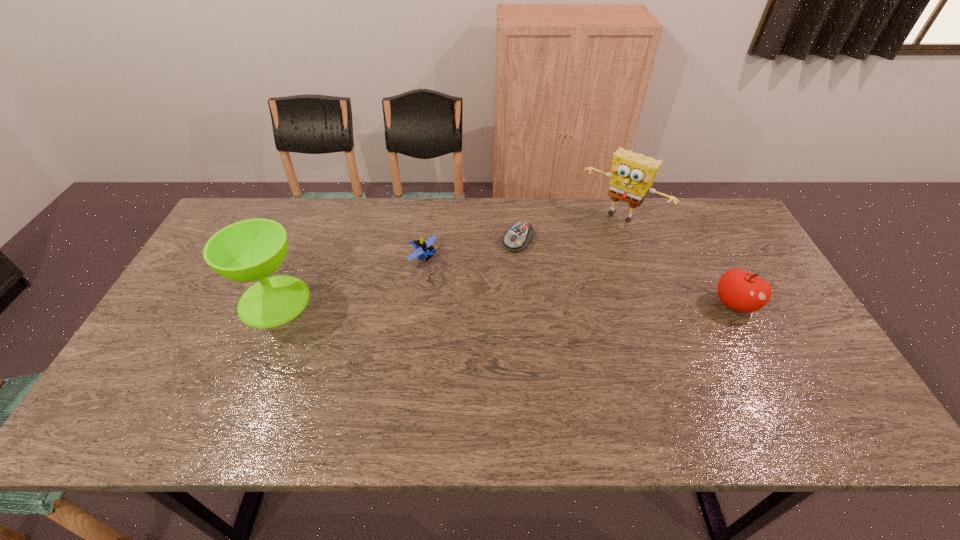
Identify the location of vacant space on the desktop that is between the leftmost object and the third shortest object and is positioned on the front-facing side of the Lego. Image resolution: width=960 pixels, height=540 pixels. (515, 303).

Find the location of a particular element. free spot on the desktop that is between the leftmost object and the rightmost object and is positioned on the face of the second object from right to left is located at coordinates (550, 303).

Where is `free space on the desktop that is between the wineglass and the rightmost object and is positioned on the wheel side of the third object from left to right`? The height and width of the screenshot is (540, 960). free space on the desktop that is between the wineglass and the rightmost object and is positioned on the wheel side of the third object from left to right is located at coordinates (473, 302).